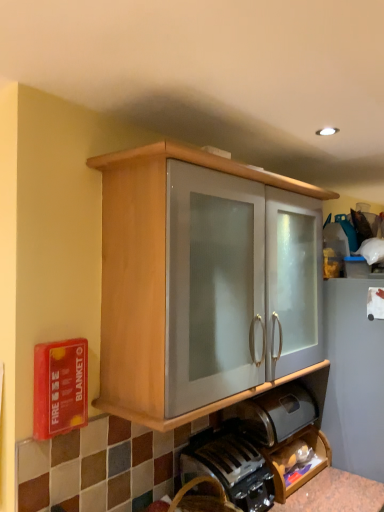
Question: Considering the positions of wooden cabinet at center and satin silver bread bin at lower center in the image, is wooden cabinet at center bigger or smaller than satin silver bread bin at lower center?

Choices:
 (A) big
 (B) small

Answer: (A)

Question: Is point (145, 338) closer or farther from the camera than point (286, 393)?

Choices:
 (A) farther
 (B) closer

Answer: (B)

Question: Considering the real-world distances, which object is closest to the wooden shelf at lower right?

Choices:
 (A) wooden cabinet at center
 (B) black plastic coffee machine at lower center
 (C) satin silver bread bin at lower center

Answer: (C)

Question: Considering the real-world distances, which object is farthest from the black plastic coffee machine at lower center?

Choices:
 (A) wooden cabinet at center
 (B) satin silver bread bin at lower center
 (C) wooden shelf at lower right

Answer: (A)